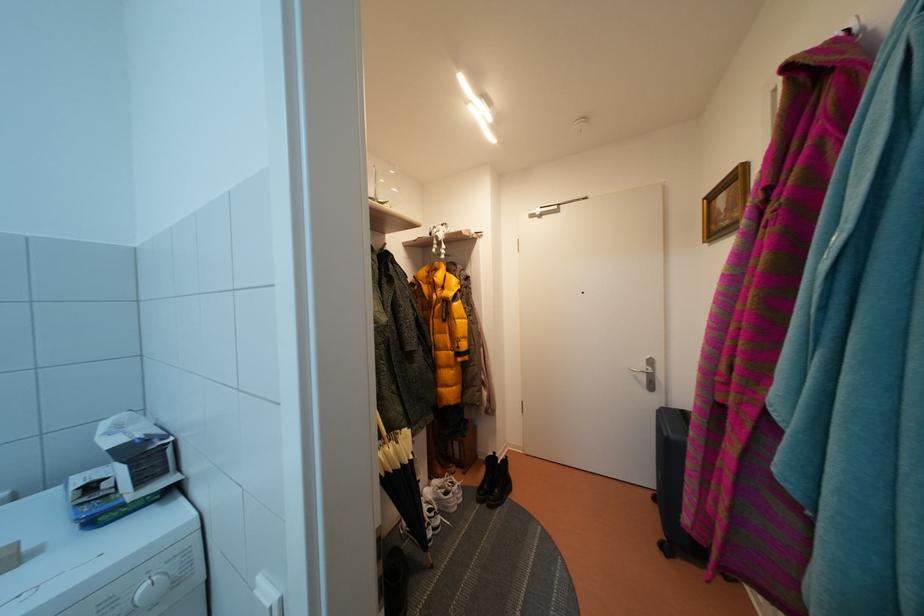
This screenshot has height=616, width=924. What do you see at coordinates (673, 484) in the screenshot? I see `a black suitcase` at bounding box center [673, 484].